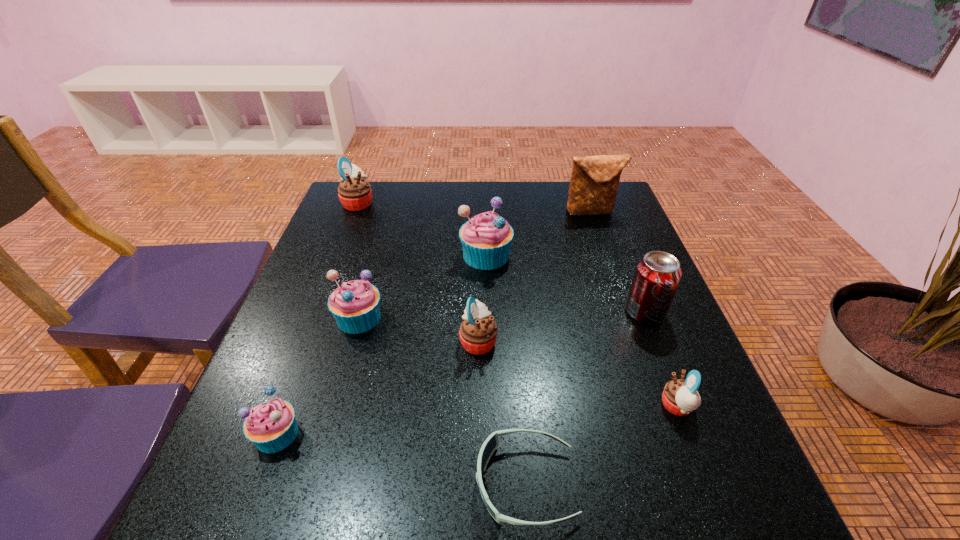
Where is `vacant space in between the soda can and the clutch bag`? Image resolution: width=960 pixels, height=540 pixels. vacant space in between the soda can and the clutch bag is located at coordinates (x=618, y=262).

Identify the location of free area in between the rightmost blue muffin and the shortest object. The height and width of the screenshot is (540, 960). (506, 369).

Identify the location of free space between the second biggest blue muffin and the farthest muffin. This screenshot has width=960, height=540. (358, 260).

I want to click on free space between the smallest blue muffin and the third farthest object, so click(381, 345).

Locate an element on the screen. This screenshot has height=540, width=960. free space between the second pink muffin from left to right and the second farthest blue muffin is located at coordinates (419, 329).

This screenshot has height=540, width=960. I want to click on free space that is in between the second biggest pink muffin and the goggles, so click(x=502, y=412).

I want to click on blank region between the shortest object and the second biggest blue muffin, so click(x=443, y=400).

You are a GUI agent. You are given a task and a screenshot of the screen. Output one action in this format:
    pyautogui.click(x=<x>, y=<y>)
    Task: Click on the blank region between the farthest pink muffin and the nearest blue muffin
    
    Given the screenshot: What is the action you would take?
    pyautogui.click(x=318, y=318)

Where is `object that is the fourth closest to the second pink muffin from right to left`? The image size is (960, 540). object that is the fourth closest to the second pink muffin from right to left is located at coordinates (657, 275).

You are a GUI agent. You are given a task and a screenshot of the screen. Output one action in this format:
    pyautogui.click(x=<x>, y=<y>)
    Task: Click on the object that is the eighth nearest to the goggles
    This screenshot has width=960, height=540.
    Given the screenshot: What is the action you would take?
    pyautogui.click(x=354, y=192)